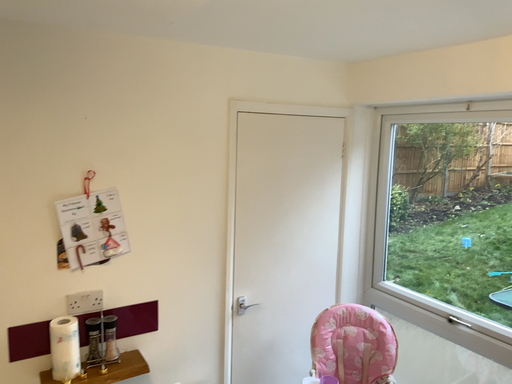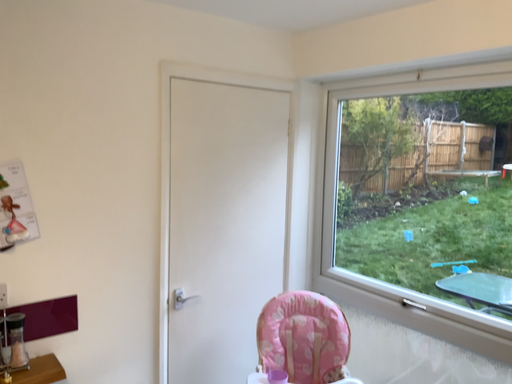
Question: How did the camera likely rotate when shooting the video?

Choices:
 (A) rotated left
 (B) rotated right

Answer: (B)